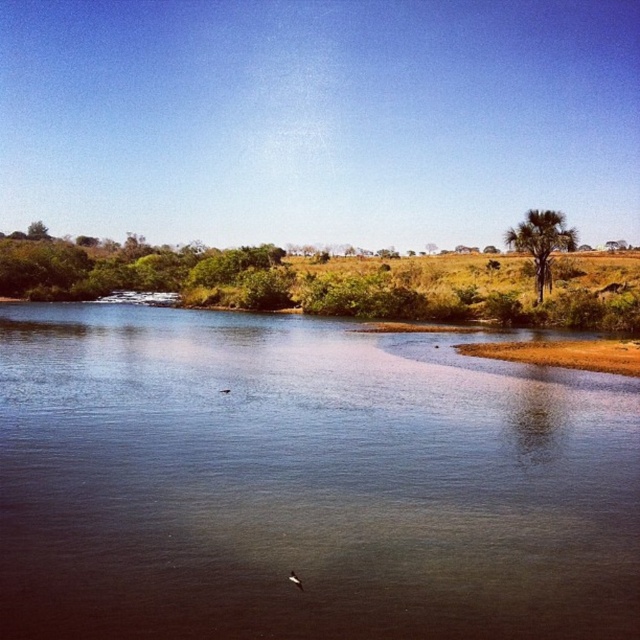
You are standing at the edge of the water in the serene landscape. You see two points marked in the image. Which point is closer to you, point (244,369) or point (289,572)?

Point (244,369) is closer to you because it is further to the viewer than point (289,572).

You are an observer standing on the lakeside. You see the blue smooth water at center and the white feathered bird at lower center. Which object is higher in the scene?

The blue smooth water at center is much taller than the white feathered bird at lower center, so the blue smooth water at center is higher in the scene.